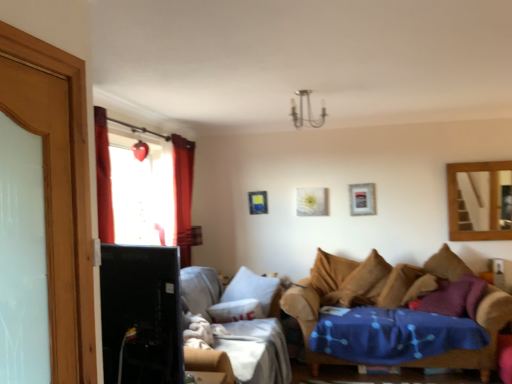
Question: Can you confirm if matte blue picture frame at center, the 3th picture frame viewed from the front, is bigger than black glossy tv at left?

Choices:
 (A) yes
 (B) no

Answer: (B)

Question: Can you confirm if matte blue picture frame at center, marked as the first picture frame in a left-to-right arrangement, is shorter than black glossy tv at left?

Choices:
 (A) no
 (B) yes

Answer: (B)

Question: Would you say black glossy tv at left is part of matte blue picture frame at center, the first picture frame in the back-to-front sequence,'s contents?

Choices:
 (A) yes
 (B) no

Answer: (B)

Question: Can you confirm if matte blue picture frame at center, marked as the first picture frame in a left-to-right arrangement, is thinner than black glossy tv at left?

Choices:
 (A) yes
 (B) no

Answer: (A)

Question: Can you confirm if matte blue picture frame at center, which is counted as the third picture frame, starting from the right, is taller than black glossy tv at left?

Choices:
 (A) no
 (B) yes

Answer: (A)

Question: Considering the positions of white matte picture frame at upper center, the 2th picture frame in the front-to-back sequence, and velvet beige couch at lower right, which ranks as the 1th studio couch in left-to-right order, in the image, is white matte picture frame at upper center, the 2th picture frame in the front-to-back sequence, bigger or smaller than velvet beige couch at lower right, which ranks as the 1th studio couch in left-to-right order,?

Choices:
 (A) small
 (B) big

Answer: (A)

Question: From the image's perspective, is white matte picture frame at upper center, which is the 2th picture frame in back-to-front order, above or below velvet beige couch at lower right, which ranks as the 1th studio couch in left-to-right order?

Choices:
 (A) above
 (B) below

Answer: (A)

Question: From a real-world perspective, is white matte picture frame at upper center, the second picture frame viewed from the left, above or below velvet beige couch at lower right, arranged as the 2th studio couch when viewed from the right?

Choices:
 (A) above
 (B) below

Answer: (A)

Question: Is white matte picture frame at upper center, the second picture frame viewed from the left, wider or thinner than velvet beige couch at lower right, which ranks as the 1th studio couch in left-to-right order?

Choices:
 (A) thin
 (B) wide

Answer: (A)

Question: From a real-world perspective, is velvet brown couch at lower right, the second studio couch when ordered from left to right, positioned above or below black glossy tv at left?

Choices:
 (A) below
 (B) above

Answer: (A)

Question: Considering the positions of velvet brown couch at lower right, the 1th studio couch when ordered from right to left, and black glossy tv at left in the image, is velvet brown couch at lower right, the 1th studio couch when ordered from right to left, taller or shorter than black glossy tv at left?

Choices:
 (A) short
 (B) tall

Answer: (B)

Question: Looking at the image, does velvet brown couch at lower right, the second studio couch when ordered from left to right, seem bigger or smaller compared to black glossy tv at left?

Choices:
 (A) big
 (B) small

Answer: (A)

Question: Is velvet brown couch at lower right, the 1th studio couch when ordered from right to left, to the left or to the right of black glossy tv at left in the image?

Choices:
 (A) left
 (B) right

Answer: (B)

Question: Considering the positions of velvet brown couch at lower right, the second studio couch when ordered from left to right, and wooden mirror at upper right in the image, is velvet brown couch at lower right, the second studio couch when ordered from left to right, bigger or smaller than wooden mirror at upper right?

Choices:
 (A) small
 (B) big

Answer: (B)

Question: From the image's perspective, is velvet brown couch at lower right, the second studio couch when ordered from left to right, positioned above or below wooden mirror at upper right?

Choices:
 (A) below
 (B) above

Answer: (A)